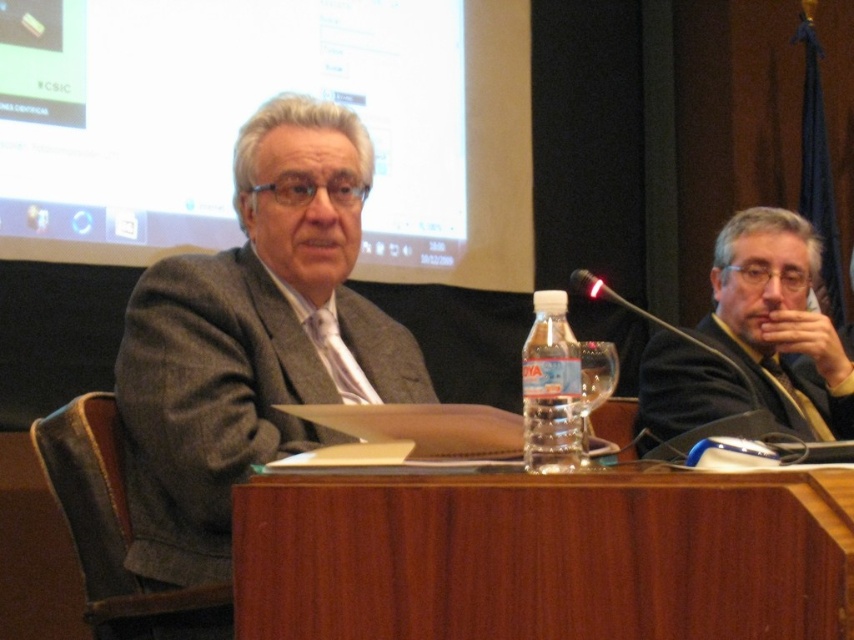
You are organizing a meeting and need to place a name tag on the table for the person in the dark gray suit at right. Where should you place it so it doesn not cover the translucent plastic bottle at center?

The dark gray suit at right is positioned over the translucent plastic bottle at center, so placing the name tag on the area where the dark gray suit at right is located would avoid covering the bottle.